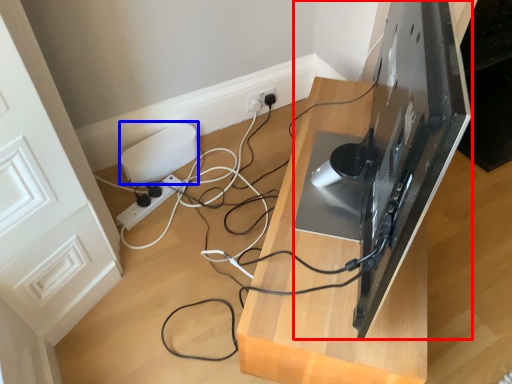
Question: Which of the following is the farthest to the observer, desktop computer (highlighted by a red box) or appliance (highlighted by a blue box)?

Choices:
 (A) desktop computer
 (B) appliance

Answer: (B)